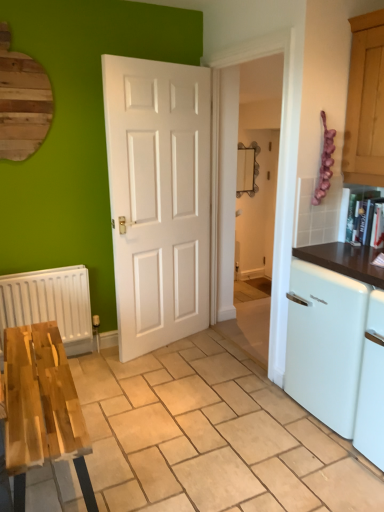
You are a GUI agent. You are given a task and a screenshot of the screen. Output one action in this format:
    pyautogui.click(x=<x>, y=<y>)
    Task: Click on the vacant area that lies to the right of white matte radiator at left
    
    Given the screenshot: What is the action you would take?
    [106, 368]